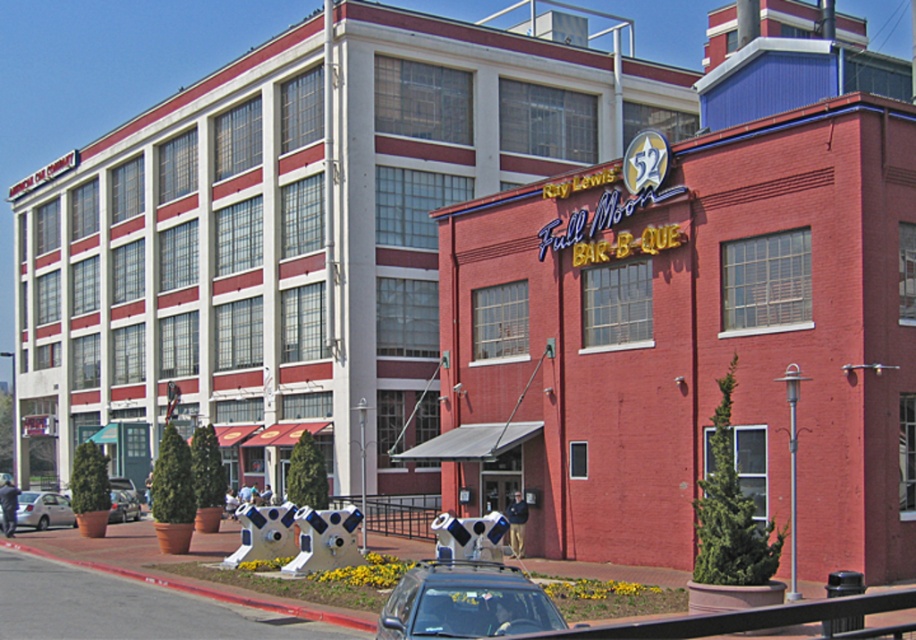
Question: Which object is the closest to the matte black car at center?

Choices:
 (A) metallic silver car at lower left
 (B) silver metallic sedan at lower left

Answer: (B)

Question: Which of the following is the closest to the observer?

Choices:
 (A) silver metallic sedan at lower left
 (B) matte black car at center
 (C) metallic silver car at lower left

Answer: (B)

Question: Observing the image, what is the correct spatial positioning of silver metallic sedan at lower left in reference to metallic silver car at lower left?

Choices:
 (A) right
 (B) left

Answer: (B)

Question: Does matte black car at center have a greater width compared to silver metallic sedan at lower left?

Choices:
 (A) no
 (B) yes

Answer: (A)

Question: Observing the image, what is the correct spatial positioning of matte black car at center in reference to silver metallic sedan at lower left?

Choices:
 (A) below
 (B) above

Answer: (B)

Question: Among these objects, which one is farthest from the camera?

Choices:
 (A) silver metallic sedan at lower left
 (B) metallic silver car at lower left
 (C) matte black car at center

Answer: (B)